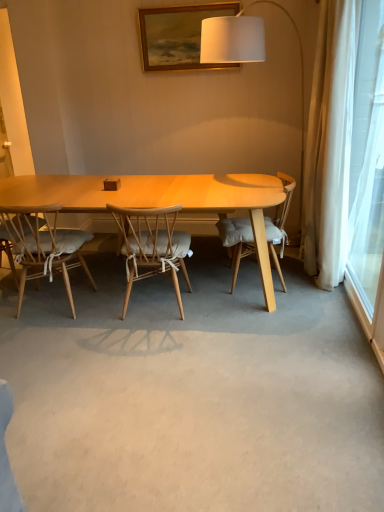
Locate an element on the screen. Image resolution: width=384 pixels, height=512 pixels. free spot above wooden picture frame at upper center (from a real-world perspective) is located at coordinates (185, 4).